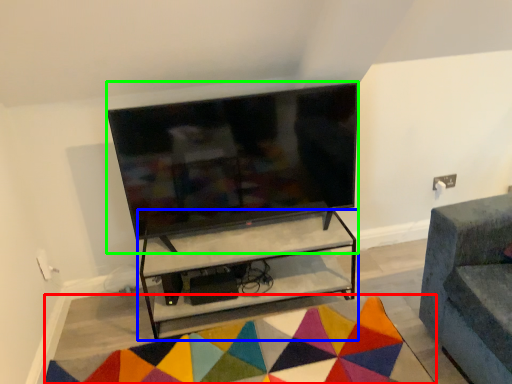
Question: Considering the real-world distances, which object is closest to mat (highlighted by a red box)? shelf (highlighted by a blue box) or television (highlighted by a green box).

Choices:
 (A) shelf
 (B) television

Answer: (A)